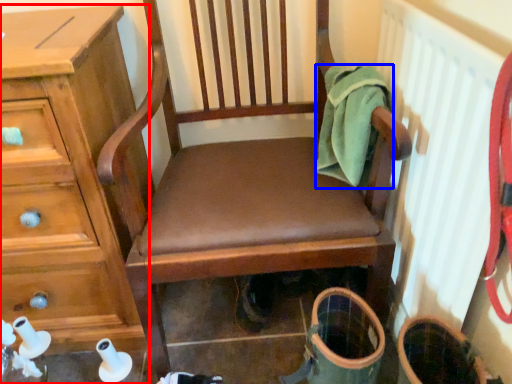
Question: Which point is further to the camera, chest of drawers (highlighted by a red box) or clothing (highlighted by a blue box)?

Choices:
 (A) chest of drawers
 (B) clothing

Answer: (B)